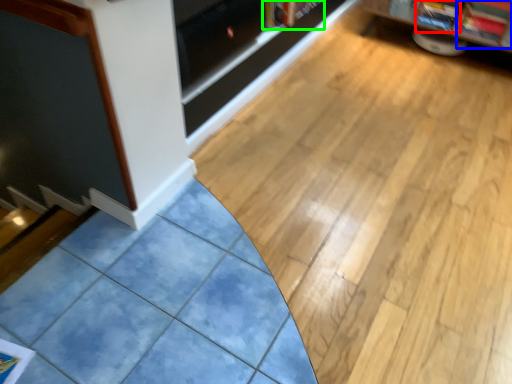
Question: Which is farther away from magazine (highlighted by a red box)? magazine (highlighted by a blue box) or book (highlighted by a green box)?

Choices:
 (A) magazine
 (B) book

Answer: (B)